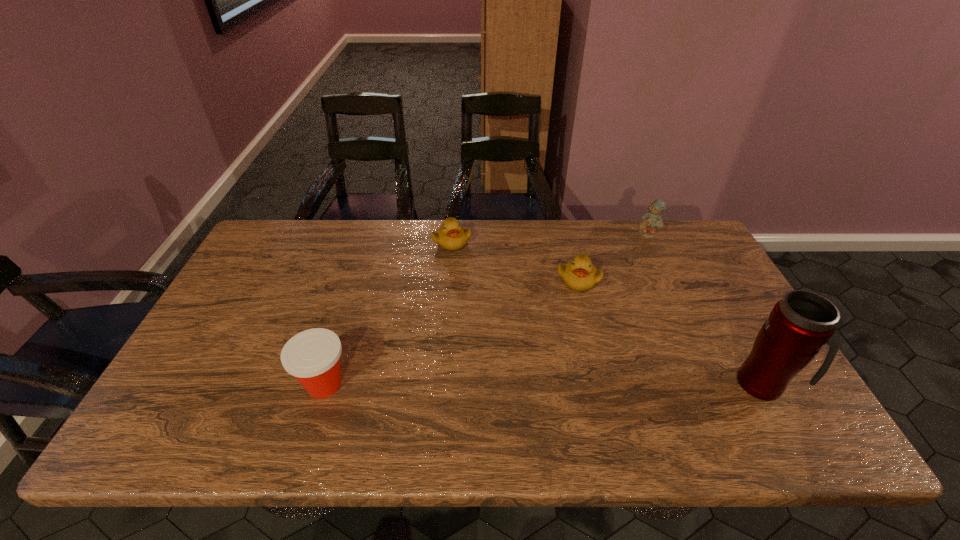
Where is `vacant area at the far left corner of the desktop`? The height and width of the screenshot is (540, 960). vacant area at the far left corner of the desktop is located at coordinates (310, 234).

Where is `vacant space at the far right corner of the desktop`? vacant space at the far right corner of the desktop is located at coordinates (667, 248).

What are the coordinates of `free spot between the tallest object and the second object from left to right` in the screenshot? It's located at (608, 313).

What are the coordinates of `vacant area between the nearer duckling and the thermos bottle` in the screenshot? It's located at (671, 332).

This screenshot has height=540, width=960. I want to click on empty space that is in between the third object from left to right and the rightmost object, so click(671, 332).

Find the location of a particular element. The image size is (960, 540). free space between the Dixie cup and the second object from right to left is located at coordinates (486, 309).

Locate an element on the screen. This screenshot has width=960, height=540. unoccupied position between the teddy bear and the farther duckling is located at coordinates (549, 238).

Find the location of a particular element. free space between the third farthest object and the teddy bear is located at coordinates (612, 257).

Locate an element on the screen. This screenshot has width=960, height=540. free spot between the Dixie cup and the rightmost object is located at coordinates (543, 384).

Image resolution: width=960 pixels, height=540 pixels. I want to click on vacant area that lies between the leftmost object and the right duckling, so click(x=451, y=332).